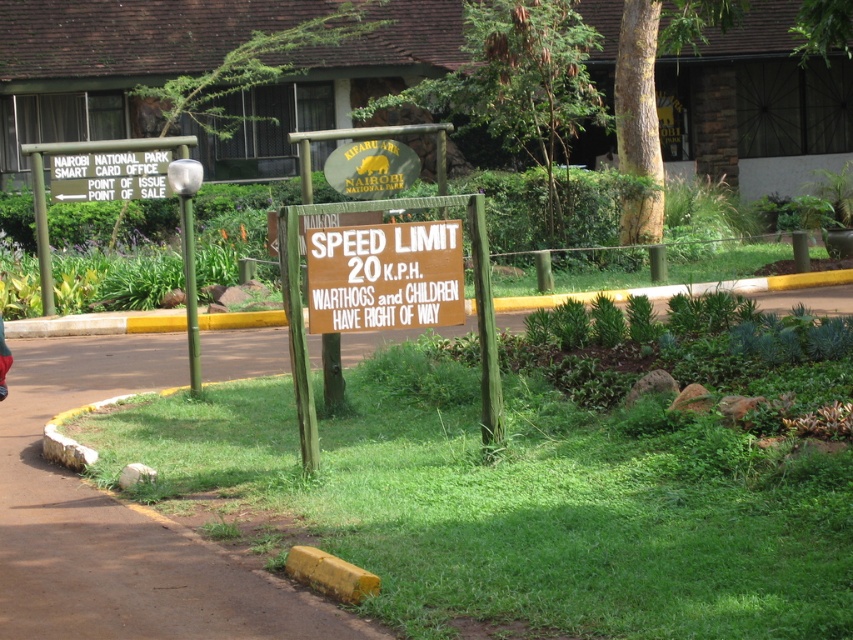
You are driving a car and see the brown wooden sign at center and the wooden signboard at center. Which one is located below the other?

The brown wooden sign at center is positioned under the wooden signboard at center.

You are a park ranger driving a vehicle in Nairobi National Park. You see two points marked on your map at coordinates point (317, 307) and point (149, 150). According to the scene description, which point is closer to you as you drive along the path?

Point (317, 307) is in front of point (149, 150), so it is closer to you as you drive along the path.

Looking at this image, you are driving a car near Nairobi National Park and see the brown wooden sign at center. According to the scene description, where is this sign placed relative to the yellow curb?

The brown wooden sign at center is situated on a patch of green grass surrounded by small shrubs and rocks, which is near the yellow curb along the edge of the grassy area. Therefore, the brown wooden sign at center is positioned close to the yellow curb but not directly on it.